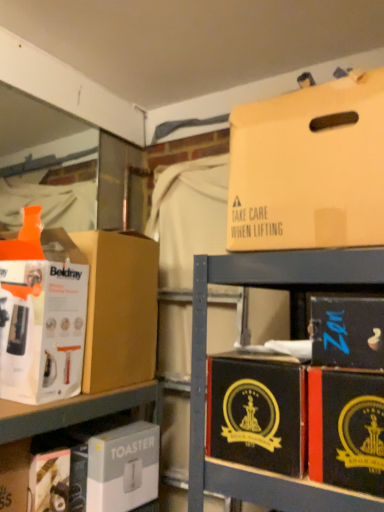
Find the location of a particular element. black cardboard box at lower right, which is the third box from top to bottom is located at coordinates (347, 332).

Measure the distance between white cardboard toaster at lower center, the 7th box viewed from the top, and camera.

The distance of white cardboard toaster at lower center, the 7th box viewed from the top, from camera is 3.53 feet.

Measure the distance between point (126, 373) and camera.

Point (126, 373) and camera are 3.89 feet apart from each other.

What do you see at coordinates (257, 412) in the screenshot? The height and width of the screenshot is (512, 384). I see `black cardboard box at center right, the second box in the bottom-to-top sequence` at bounding box center [257, 412].

This screenshot has height=512, width=384. Find the location of `black cardboard box at lower right, arranged as the fifth box when viewed from the top`. black cardboard box at lower right, arranged as the fifth box when viewed from the top is located at coordinates (346, 429).

In order to face white cardboard box at lower left, should I rotate leftwards or rightwards?

A 24.207 degree turn to the left will do.

I want to click on black cardboard box at lower right, which is the third box from top to bottom, so click(347, 332).

Is beige cardboard box at upper right, which is counted as the 7th box, starting from the bottom, positioned behind black cardboard box at lower right, arranged as the fifth box when viewed from the top?

No, it is in front of black cardboard box at lower right, arranged as the fifth box when viewed from the top.

Considering the relative sizes of beige cardboard box at upper right, the 1th box viewed from the top, and black cardboard box at lower right, arranged as the fifth box when viewed from the top, in the image provided, is beige cardboard box at upper right, the 1th box viewed from the top, taller than black cardboard box at lower right, arranged as the fifth box when viewed from the top,?

Yes.

From a real-world perspective, which object rests below the other?

In real-world perspective, black cardboard box at lower right, placed as the third box when sorted from bottom to top, is lower.

Identify the location of box that is in front of the black cardboard box at lower right, arranged as the fifth box when viewed from the top. This screenshot has height=512, width=384. (309, 167).

How much distance is there between black cardboard box at lower right, placed as the third box when sorted from bottom to top, and white cardboard box at lower left?

A distance of 69.76 centimeters exists between black cardboard box at lower right, placed as the third box when sorted from bottom to top, and white cardboard box at lower left.

How different are the orientations of black cardboard box at lower right, arranged as the fifth box when viewed from the top, and white cardboard box at lower left in degrees?

There is a 89.1-degree angle between the facing directions of black cardboard box at lower right, arranged as the fifth box when viewed from the top, and white cardboard box at lower left.

Which of these two, black cardboard box at lower right, placed as the third box when sorted from bottom to top, or white cardboard box at lower left, stands shorter?

With less height is black cardboard box at lower right, placed as the third box when sorted from bottom to top.

Is there a large distance between black cardboard box at lower right, placed as the third box when sorted from bottom to top, and white cardboard box at lower left?

black cardboard box at lower right, placed as the third box when sorted from bottom to top, is near white cardboard box at lower left, not far away.

Is white cardboard box at left, which is counted as the second box, starting from the top, further to the viewer compared to white cardboard toaster at lower center, the 7th box viewed from the top?

No, it is in front of white cardboard toaster at lower center, the 7th box viewed from the top.

From the image's perspective, which is above, white cardboard box at left, which is counted as the second box, starting from the top, or white cardboard toaster at lower center, the 7th box viewed from the top?

white cardboard box at left, which is counted as the second box, starting from the top, is shown above in the image.

At what (x,y) coordinates should I click in order to perform the action: click on the 1st box in front when counting from the white cardboard toaster at lower center, the 7th box viewed from the top. Please return your answer as a coordinate pair (x, y). Image resolution: width=384 pixels, height=512 pixels. Looking at the image, I should click on (43, 322).

From a real-world perspective, between black cardboard box at center right, acting as the sixth box starting from the top, and black cardboard box at lower right, arranged as the fifth box when viewed from the top, who is vertically higher?

In real-world perspective, black cardboard box at center right, acting as the sixth box starting from the top, is above.

In terms of width, does black cardboard box at center right, the second box in the bottom-to-top sequence, look wider or thinner when compared to black cardboard box at lower right, arranged as the fifth box when viewed from the top?

In the image, black cardboard box at center right, the second box in the bottom-to-top sequence, appears to be more narrow than black cardboard box at lower right, arranged as the fifth box when viewed from the top.

Which of these two, black cardboard box at center right, the second box in the bottom-to-top sequence, or black cardboard box at lower right, arranged as the fifth box when viewed from the top, stands shorter?

black cardboard box at center right, the second box in the bottom-to-top sequence, is shorter.

Is black cardboard box at center right, acting as the sixth box starting from the top, in contact with black cardboard box at lower right, placed as the third box when sorted from bottom to top?

Yes, black cardboard box at center right, acting as the sixth box starting from the top, is touching black cardboard box at lower right, placed as the third box when sorted from bottom to top.

From the image's perspective, is black cardboard box at lower right, arranged as the fifth box when viewed from the top, on top of beige cardboard box at upper right, the 1th box viewed from the top?

Actually, black cardboard box at lower right, arranged as the fifth box when viewed from the top, appears below beige cardboard box at upper right, the 1th box viewed from the top, in the image.

Can you confirm if black cardboard box at lower right, arranged as the fifth box when viewed from the top, is positioned to the left of beige cardboard box at upper right, the 1th box viewed from the top?

In fact, black cardboard box at lower right, arranged as the fifth box when viewed from the top, is to the right of beige cardboard box at upper right, the 1th box viewed from the top.

At what (x,y) coordinates should I click in order to perform the action: click on box that is the 2nd object to the left of the black cardboard box at lower right, placed as the third box when sorted from bottom to top, starting at the anchor. Please return your answer as a coordinate pair (x, y). The width and height of the screenshot is (384, 512). Looking at the image, I should click on (309, 167).

How different are the orientations of white cardboard box at left, which is counted as the second box, starting from the top, and black cardboard box at lower right, arranged as the fifth box when viewed from the top, in degrees?

The angle between the facing direction of white cardboard box at left, which is counted as the second box, starting from the top, and the facing direction of black cardboard box at lower right, arranged as the fifth box when viewed from the top, is 87.5 degrees.

Is white cardboard box at left, which is counted as the second box, starting from the top, placed right next to black cardboard box at lower right, arranged as the fifth box when viewed from the top?

No, white cardboard box at left, which is counted as the second box, starting from the top, is not in contact with black cardboard box at lower right, arranged as the fifth box when viewed from the top.

Does white cardboard box at left, which is counted as the second box, starting from the top, turn towards black cardboard box at lower right, arranged as the fifth box when viewed from the top?

No, white cardboard box at left, which is counted as the second box, starting from the top, does not turn towards black cardboard box at lower right, arranged as the fifth box when viewed from the top.

Which of these two, white cardboard box at left, which ranks as the sixth box in bottom-to-top order, or black cardboard box at lower right, placed as the third box when sorted from bottom to top, stands shorter?

Standing shorter between the two is black cardboard box at lower right, placed as the third box when sorted from bottom to top.

Is point (356, 404) positioned before point (95, 352)?

That is True.

Could you measure the distance between black cardboard box at lower right, arranged as the fifth box when viewed from the top, and matte cardboard box at left, arranged as the fourth box when viewed from the top?

They are 65.01 centimeters apart.

Is black cardboard box at lower right, arranged as the fifth box when viewed from the top, directly adjacent to matte cardboard box at left, acting as the 4th box starting from the bottom?

No, black cardboard box at lower right, arranged as the fifth box when viewed from the top, is not with matte cardboard box at left, acting as the 4th box starting from the bottom.

Which of these two, black cardboard box at lower right, placed as the third box when sorted from bottom to top, or matte cardboard box at left, arranged as the fourth box when viewed from the top, stands taller?

With more height is matte cardboard box at left, arranged as the fourth box when viewed from the top.

At what (x,y) coordinates should I click in order to perform the action: click on box in front of the black cardboard box at lower right, placed as the third box when sorted from bottom to top. Please return your answer as a coordinate pair (x, y). This screenshot has height=512, width=384. Looking at the image, I should click on (309, 167).

Locate an element on the screen. the 1st box positioned above the white cardboard box at lower left (from a real-world perspective) is located at coordinates (346, 429).

Based on their spatial positions, is black cardboard box at lower right, which ranks as the 5th box in bottom-to-top order, or black cardboard box at lower right, placed as the third box when sorted from bottom to top, closer to white cardboard box at lower left?

Based on the image, black cardboard box at lower right, placed as the third box when sorted from bottom to top, appears to be nearer to white cardboard box at lower left.

Estimate the real-world distances between objects in this image. Which object is further from beige cardboard box at upper right, which is counted as the 7th box, starting from the bottom, white cardboard box at lower left or matte cardboard box at left, arranged as the fourth box when viewed from the top?

white cardboard box at lower left is positioned further to the anchor beige cardboard box at upper right, which is counted as the 7th box, starting from the bottom.

Consider the image. Based on their spatial positions, is black cardboard box at center right, acting as the sixth box starting from the top, or white cardboard box at left, which ranks as the sixth box in bottom-to-top order, closer to white cardboard toaster at lower center, the 1th box ordered from the bottom?

white cardboard box at left, which ranks as the sixth box in bottom-to-top order.

Looking at the image, which one is located closer to white cardboard box at lower left, matte cardboard box at left, acting as the 4th box starting from the bottom, or black cardboard box at center right, acting as the sixth box starting from the top?

Among the two, matte cardboard box at left, acting as the 4th box starting from the bottom, is located nearer to white cardboard box at lower left.

Based on their spatial positions, is white cardboard box at lower left or white cardboard toaster at lower center, the 1th box ordered from the bottom, further from white cardboard box at left, which is counted as the second box, starting from the top?

Based on the image, white cardboard toaster at lower center, the 1th box ordered from the bottom, appears to be further to white cardboard box at left, which is counted as the second box, starting from the top.

When comparing their distances from white cardboard box at left, which is counted as the second box, starting from the top, does white cardboard toaster at lower center, the 7th box viewed from the top, or black cardboard box at center right, acting as the sixth box starting from the top, seem further?

black cardboard box at center right, acting as the sixth box starting from the top, is further to white cardboard box at left, which is counted as the second box, starting from the top.

Consider the image. Considering their positions, is matte cardboard box at left, arranged as the fourth box when viewed from the top, positioned closer to black cardboard box at center right, acting as the sixth box starting from the top, than black cardboard box at lower right, which is the third box from top to bottom?

black cardboard box at lower right, which is the third box from top to bottom, lies closer to black cardboard box at center right, acting as the sixth box starting from the top, than the other object.

Consider the image. Estimate the real-world distances between objects in this image. Which object is further from white cardboard toaster at lower center, the 7th box viewed from the top, white cardboard box at lower left or black cardboard box at lower right, which is the third box from top to bottom?

black cardboard box at lower right, which is the third box from top to bottom, is further to white cardboard toaster at lower center, the 7th box viewed from the top.

Locate an element on the screen. Image resolution: width=384 pixels, height=512 pixels. storage box between matte cardboard box at left, arranged as the fourth box when viewed from the top, and white cardboard toaster at lower center, the 7th box viewed from the top, in the up-down direction is located at coordinates tap(14, 475).

Locate an element on the screen. The height and width of the screenshot is (512, 384). box located between matte cardboard box at left, arranged as the fourth box when viewed from the top, and black cardboard box at center right, the second box in the bottom-to-top sequence, in the left-right direction is located at coordinates (123, 468).

Find the location of a particular element. The image size is (384, 512). storage box between beige cardboard box at upper right, the 1th box viewed from the top, and white cardboard toaster at lower center, the 7th box viewed from the top, vertically is located at coordinates (14, 475).

This screenshot has height=512, width=384. In order to click on storage box between white cardboard box at left, which ranks as the sixth box in bottom-to-top order, and white cardboard toaster at lower center, the 1th box ordered from the bottom, from top to bottom in this screenshot , I will do `click(14, 475)`.